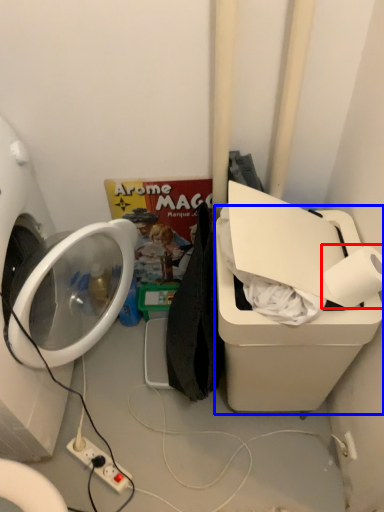
Question: Which object appears closest to the camera in this image, toilet paper (highlighted by a red box) or water cooler (highlighted by a blue box)?

Choices:
 (A) toilet paper
 (B) water cooler

Answer: (B)